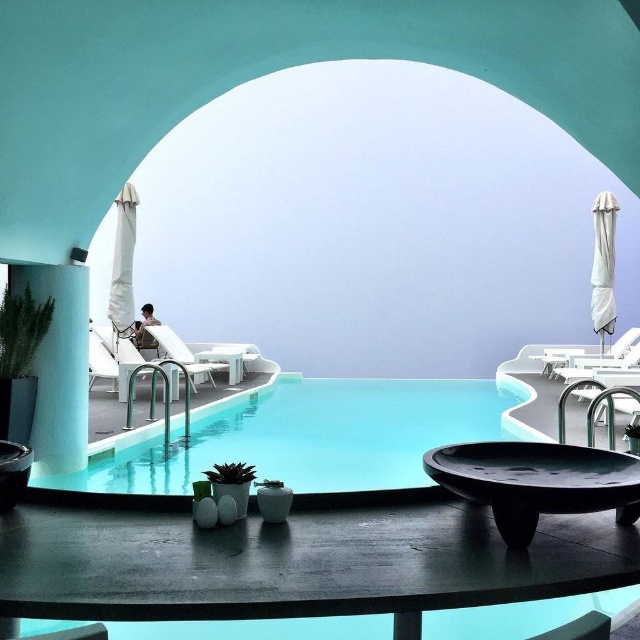
Who is more forward, (337,564) or (241,365)?

Point (337,564)

Is smooth dark wood table at lower center wider than matte white table at center?

Correct, the width of smooth dark wood table at lower center exceeds that of matte white table at center.

Who is more forward, (364, 524) or (195, 358)?

Point (364, 524) is in front.

Where is `smooth dark wood table at lower center`? This screenshot has width=640, height=640. smooth dark wood table at lower center is located at coordinates (296, 563).

Which is in front, point (598, 564) or point (92, 352)?

Point (598, 564) is in front.

Which is more to the right, smooth dark wood table at lower center or white plastic chair at left?

→ smooth dark wood table at lower center

Which is in front, point (186, 515) or point (116, 358)?

Point (186, 515)

In order to click on smooth dark wood table at lower center in this screenshot , I will do `click(296, 563)`.

Which of these two, smooth dark wood table at lower center or clear glass swimming pool at center, stands shorter?

Standing shorter between the two is clear glass swimming pool at center.

Does smooth dark wood table at lower center appear on the right side of clear glass swimming pool at center?

In fact, smooth dark wood table at lower center is to the left of clear glass swimming pool at center.

Locate an element on the screen. The width and height of the screenshot is (640, 640). smooth dark wood table at lower center is located at coordinates (296, 563).

Where is `smooth dark wood table at lower center`? The height and width of the screenshot is (640, 640). smooth dark wood table at lower center is located at coordinates (296, 563).